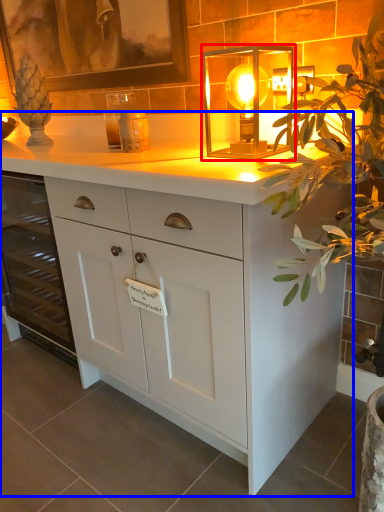
Question: Which point is closer to the camera, lamp (highlighted by a red box) or chest of drawers (highlighted by a blue box)?

Choices:
 (A) lamp
 (B) chest of drawers

Answer: (B)